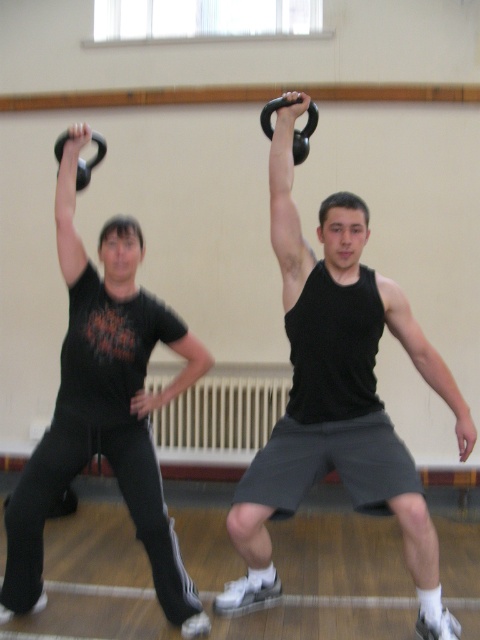
Does black rubber kettlebell at upper center have a larger size compared to black rubber barbell at upper left?

Incorrect, black rubber kettlebell at upper center is not larger than black rubber barbell at upper left.

Does black rubber kettlebell at upper center appear on the right side of black rubber barbell at upper left?

Correct, you'll find black rubber kettlebell at upper center to the right of black rubber barbell at upper left.

Where is `black rubber kettlebell at upper center`? Image resolution: width=480 pixels, height=640 pixels. black rubber kettlebell at upper center is located at coordinates (304, 134).

Does black matte arm at upper center appear over black rubber barbell at upper left?

No, black matte arm at upper center is not above black rubber barbell at upper left.

Measure the distance from black matte arm at upper center to black rubber barbell at upper left.

black matte arm at upper center is 5.44 feet away from black rubber barbell at upper left.

Is point (397, 304) in front of point (83, 163)?

Yes, point (397, 304) is in front of point (83, 163).

This screenshot has height=640, width=480. Identify the location of black matte arm at upper center. (425, 360).

Can you confirm if matte black kettlebell at upper left is positioned to the right of black matte t-shirt at center?

No, matte black kettlebell at upper left is not to the right of black matte t-shirt at center.

Is point (84, 266) positioned after point (157, 392)?

No, (84, 266) is closer to viewer.

Where is `matte black kettlebell at upper left`? This screenshot has height=640, width=480. matte black kettlebell at upper left is located at coordinates (70, 205).